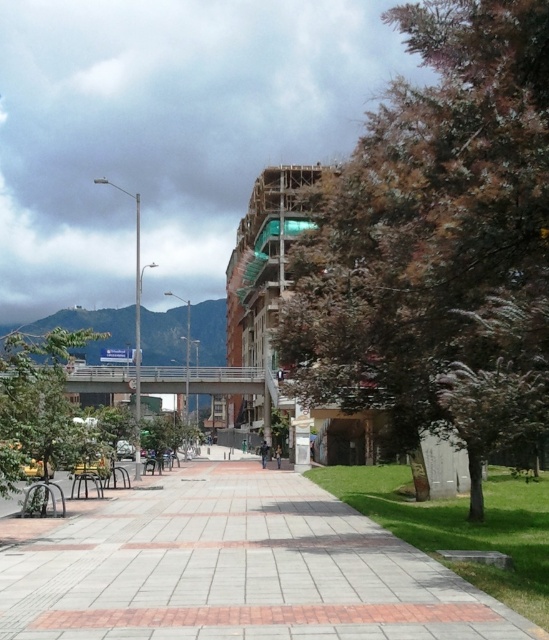
You are a delivery person needing to cross the brick paved walkway at center. Is there any obstruction from the green leafy tree at lower left that might block your path?

The brick paved walkway at center is positioned under the green leafy tree at lower left, so the tree may cast a shadow but does not physically block the walkway. The path should remain accessible.

You are standing at point [16,358] and want to walk to point [222,636]. Which direction should you face to walk towards your destination?

You should face towards the direction of point [222,636], which is in front of point [16,358].